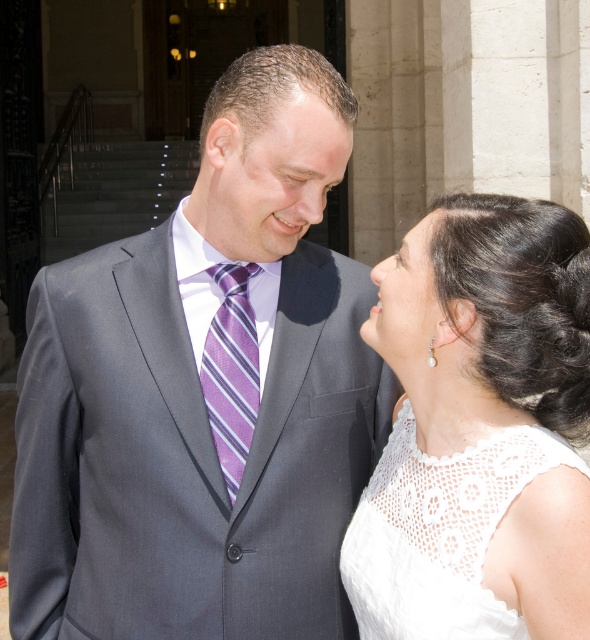
Can you confirm if matte gray suit at center is positioned above matte gray forehead at upper center?

Result: No.

Who is more distant from viewer, (x=192, y=368) or (x=306, y=147)?

Positioned behind is point (x=192, y=368).

You are a GUI agent. You are given a task and a screenshot of the screen. Output one action in this format:
    pyautogui.click(x=<x>, y=<y>)
    Task: Click on the matte gray suit at center
    This screenshot has width=590, height=640.
    Given the screenshot: What is the action you would take?
    pyautogui.click(x=199, y=404)

Can you confirm if white lace dress at center is positioned to the right of matte gray forehead at upper center?

Yes, white lace dress at center is to the right of matte gray forehead at upper center.

Which is behind, point (372, 579) or point (306, 88)?

Point (306, 88)

Which is behind, point (442, 570) or point (326, 113)?

Point (326, 113)

What are the coordinates of `white lace dress at center` in the screenshot? It's located at (440, 532).

Which is more to the right, matte gray suit at center or purple striped tie at center?

purple striped tie at center

Does matte gray suit at center have a lesser height compared to purple striped tie at center?

No.

Identify the location of matte gray suit at center. (199, 404).